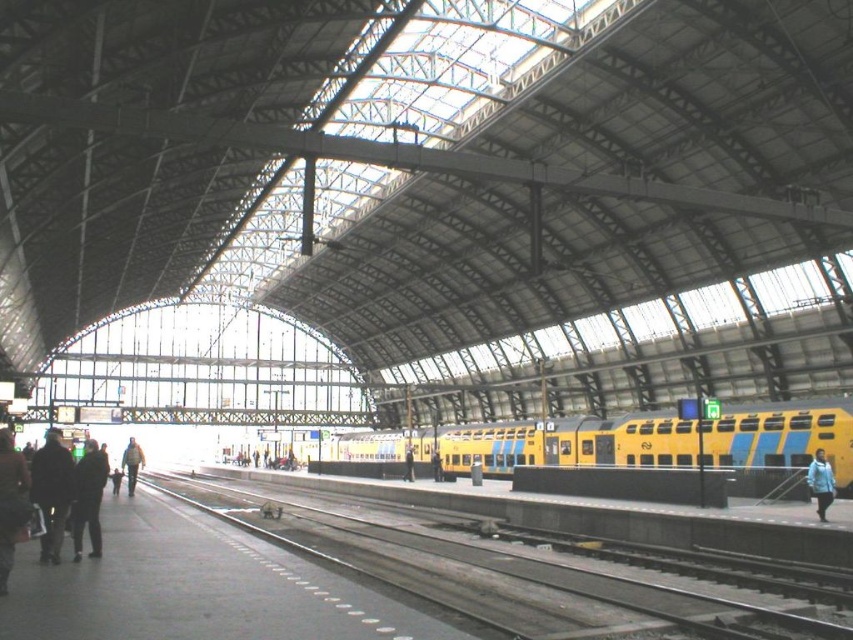
Which is above, dark brown leather jacket at lower left or dark gray jacket at left?

dark brown leather jacket at lower left is above.

Who is more forward, (0, 461) or (80, 512)?

Positioned in front is point (0, 461).

Find the location of a particular element. dark brown leather jacket at lower left is located at coordinates (10, 502).

Which is more to the left, blue fabric jacket at lower right or light brown leather jacket at center?

light brown leather jacket at center is more to the left.

Where is `blue fabric jacket at lower right`? This screenshot has height=640, width=853. blue fabric jacket at lower right is located at coordinates (820, 483).

Can you confirm if dark brown leather jacket at left is taller than dark gray jacket at left?

Correct, dark brown leather jacket at left is much taller as dark gray jacket at left.

Between dark brown leather jacket at left and dark gray jacket at left, which one appears on the right side from the viewer's perspective?

From the viewer's perspective, dark gray jacket at left appears more on the right side.

Identify the location of dark brown leather jacket at left. This screenshot has width=853, height=640. (51, 492).